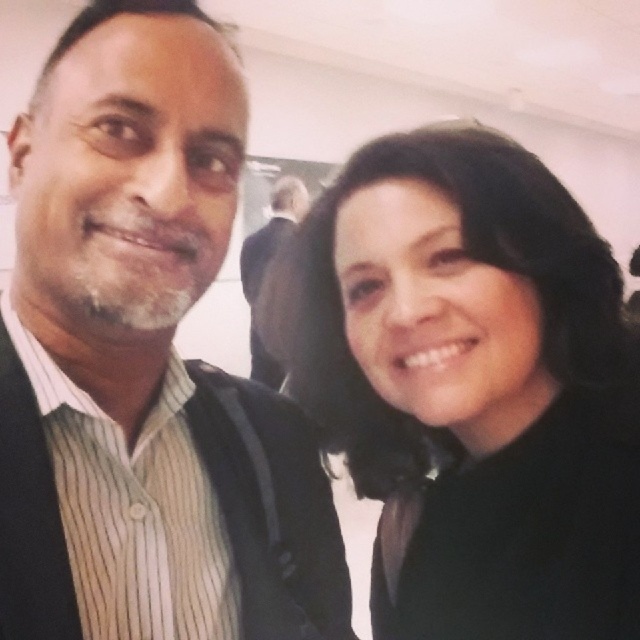
You are taking a photo of two people standing at point [163,628] and point [563,284]. Which person should you focus on first to ensure their face is clear in the photo?

You should focus on the person at point [163,628] first because it is in front of point [563,284], so their face will be clearer in the photo.

You are a photographer adjusting the lighting for a portrait. You notice the black matte hair at center and the dark suit at center. Which object should you focus on first to ensure the subject in front is properly lit?

The black matte hair at center is in front of the dark suit at center, so you should focus on lighting the black matte hair at center first to ensure the subject in front is properly lit.

You are a photographer setting up for a group photo. You need to position two subjects so that their black matte hair at center and dark suit at center are exactly 3 meters apart. Based on the current scene, will you need to move them closer together or farther apart?

The black matte hair at center and dark suit at center are currently 2.94 meters apart. Since 2.94 meters is less than 3 meters, you will need to move them farther apart to reach the desired distance.